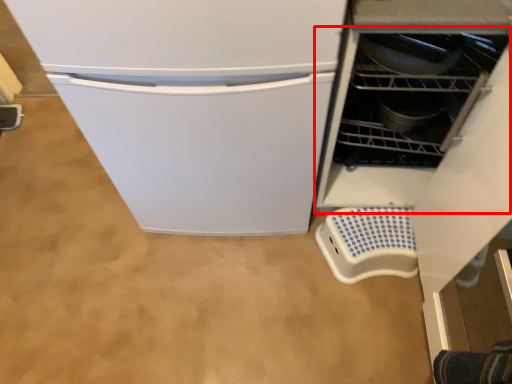
Question: From the image's perspective, where is dish washer (annotated by the red box) located in relation to appliance in the image?

Choices:
 (A) below
 (B) above

Answer: (B)